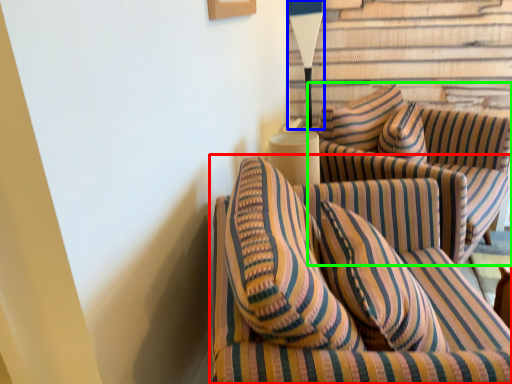
Question: Estimate the real-world distances between objects in this image. Which object is farther from studio couch (highlighted by a red box), table lamp (highlighted by a blue box) or studio couch (highlighted by a green box)?

Choices:
 (A) table lamp
 (B) studio couch

Answer: (A)